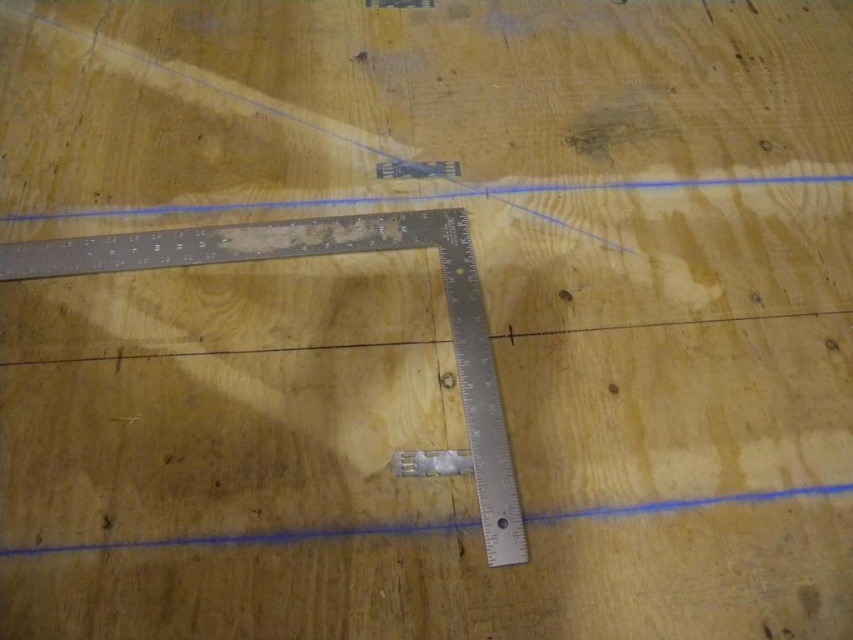
You are a carpenter working on a project and need to ensure precision. You have a metallic ruler at bottom and a blue line at upper center. Which of these two items is narrower in width?

The metallic ruler at bottom has a lesser width compared to the blue line at upper center, so the metallic ruler at bottom is narrower.

You are a carpenter working on a project and need to align your tools properly. You have a metallic ruler at bottom and a blue line at upper center. Which object is closer to you on the wooden surface?

The metallic ruler at bottom is closer to you because it is in front of the blue line at upper center.